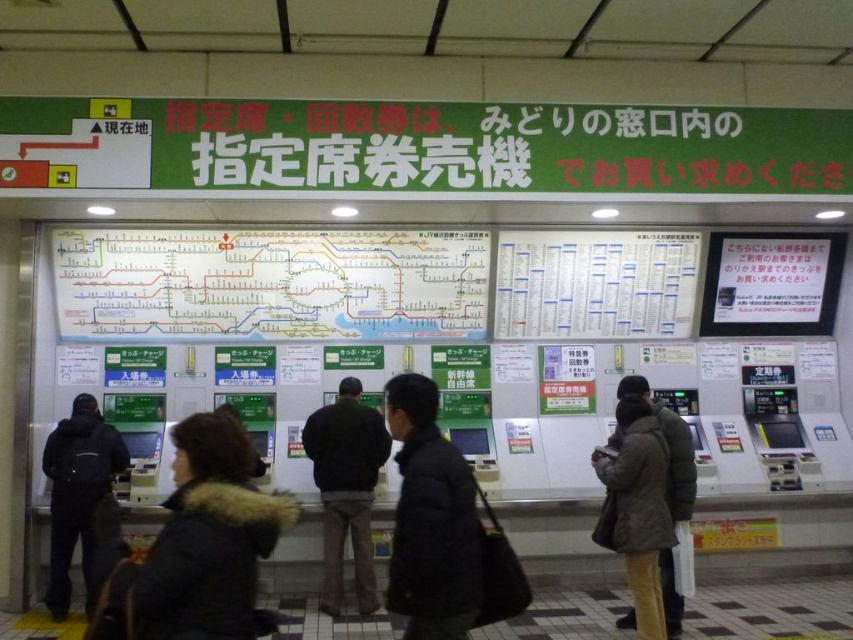
Can you confirm if white paper map at center is positioned to the left of black matte jacket at center?

Yes, white paper map at center is to the left of black matte jacket at center.

Is point (155, 232) positioned behind point (432, 440)?

Yes, point (155, 232) is farther from viewer.

At what (x,y) coordinates should I click in order to perform the action: click on white paper map at center. Please return your answer as a coordinate pair (x, y). Image resolution: width=853 pixels, height=640 pixels. Looking at the image, I should click on pyautogui.click(x=270, y=284).

Can you confirm if dark gray fur-lined coat at center is bigger than dark brown jacket at lower right?

No, dark gray fur-lined coat at center is not bigger than dark brown jacket at lower right.

Based on the photo, can you confirm if dark gray fur-lined coat at center is positioned above dark brown jacket at lower right?

Yes, dark gray fur-lined coat at center is above dark brown jacket at lower right.

What are the coordinates of `dark gray fur-lined coat at center` in the screenshot? It's located at (207, 540).

Consider the image. Is dark brown jacket at center wider than dark brown jacket at lower right?

Correct, the width of dark brown jacket at center exceeds that of dark brown jacket at lower right.

Which is behind, point (370, 481) or point (637, 465)?

The point (370, 481) is behind.

Does point (363, 584) lie in front of point (666, 502)?

No, (363, 584) is behind (666, 502).

This screenshot has height=640, width=853. Identify the location of dark brown jacket at center. (346, 488).